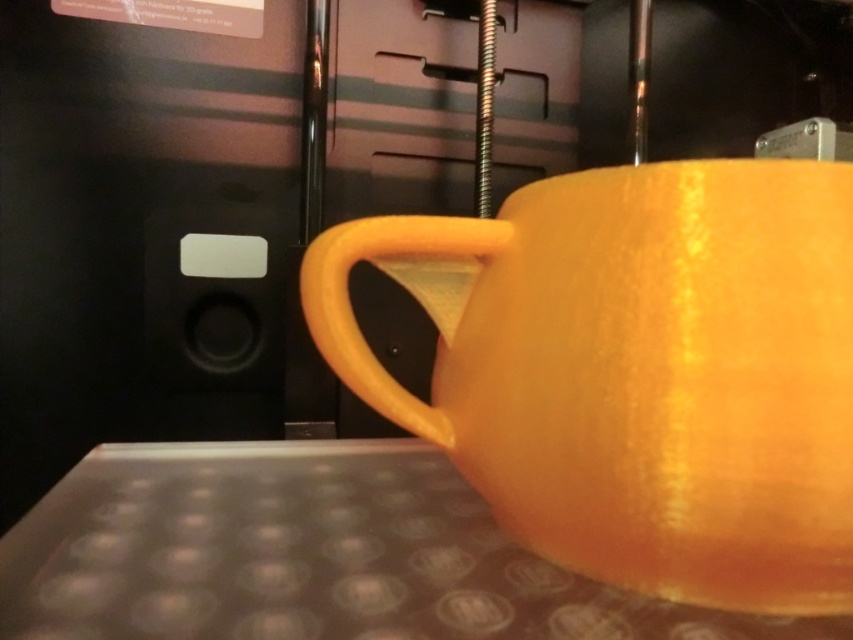
The height and width of the screenshot is (640, 853). I want to click on glossy ceramic mug at upper center, so click(636, 371).

Is point (553, 241) farther from viewer compared to point (397, 557)?

No, it is in front of (397, 557).

Who is more distant from viewer, [685,412] or [630,625]?

The point [630,625] is behind.

Where is `glossy ceramic mug at upper center`? This screenshot has height=640, width=853. glossy ceramic mug at upper center is located at coordinates (636, 371).